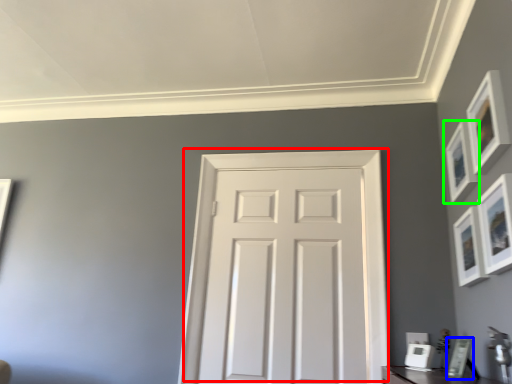
Question: Which object is positioned closest to door (highlighted by a red box)? Select from picture frame (highlighted by a blue box) and picture frame (highlighted by a green box).

Choices:
 (A) picture frame
 (B) picture frame

Answer: (B)